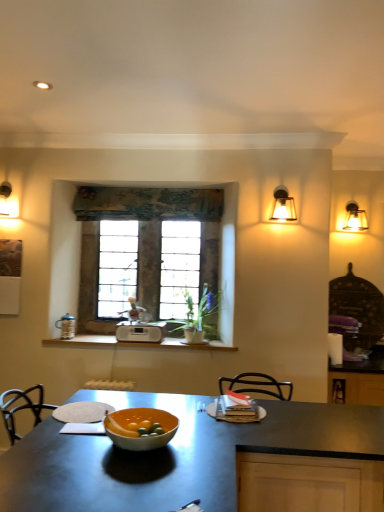
Locate an element on the screen. free space in front of matte orange bowl at center is located at coordinates (116, 488).